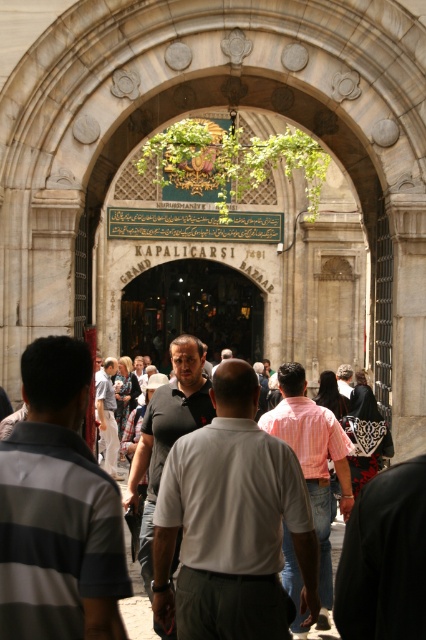
Question: Which of the following is the closest to the observer?

Choices:
 (A) white matte shirt at center
 (B) pink striped shirt at center
 (C) gray striped shirt at center

Answer: (C)

Question: Is white matte shirt at center wider than light gray shirt at center?

Choices:
 (A) yes
 (B) no

Answer: (A)

Question: Which point is closer to the camera?

Choices:
 (A) white matte shirt at center
 (B) pink striped shirt at center

Answer: (A)

Question: Which object is the closest to the light gray shirt at center?

Choices:
 (A) pink striped shirt at center
 (B) gray striped shirt at center
 (C) white matte shirt at center

Answer: (A)

Question: Is white matte shirt at center above gray striped shirt at center?

Choices:
 (A) yes
 (B) no

Answer: (B)

Question: Can you confirm if pink striped shirt at center is bigger than light gray shirt at center?

Choices:
 (A) no
 (B) yes

Answer: (B)